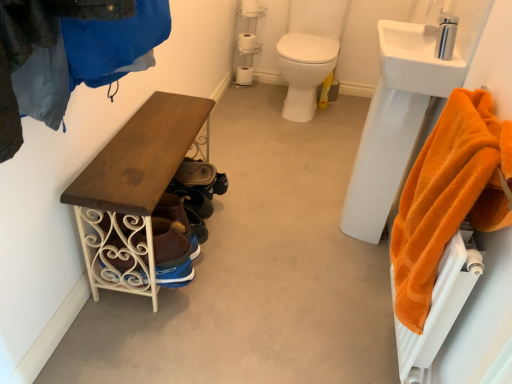
Locate an element on the screen. This screenshot has width=512, height=384. vacant space that's between wooden bench at left and white glossy toilet at center is located at coordinates (252, 150).